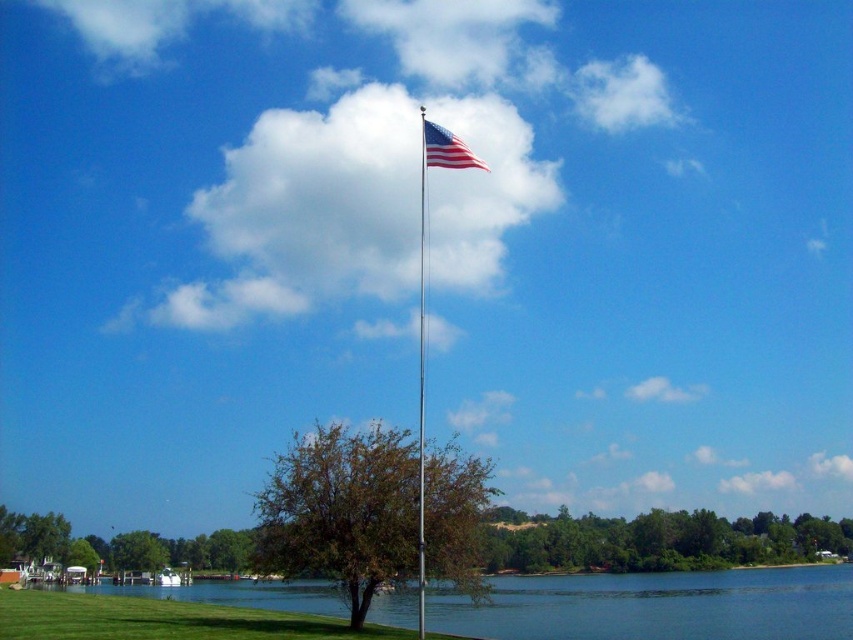
Question: Observing the image, what is the correct spatial positioning of brown textured tree at center in reference to silver metallic flag pole at center?

Choices:
 (A) right
 (B) left

Answer: (B)

Question: Based on their relative distances, which object is nearer to the green leafy tree at lower left?

Choices:
 (A) brown textured tree at center
 (B) silver metallic flag pole at center
 (C) green grass at lower left
 (D) american flag at upper center

Answer: (C)

Question: Among these objects, which one is nearest to the camera?

Choices:
 (A) american flag at upper center
 (B) green leafy tree at lower left

Answer: (A)

Question: Is green grass at lower left below silver metallic flag pole at center?

Choices:
 (A) yes
 (B) no

Answer: (A)

Question: Is green grass at lower left smaller than silver metallic flag pole at center?

Choices:
 (A) yes
 (B) no

Answer: (B)

Question: Which of these objects is positioned closest to the green grass at lower left?

Choices:
 (A) american flag at upper center
 (B) brown textured tree at center
 (C) silver metallic flag pole at center

Answer: (C)